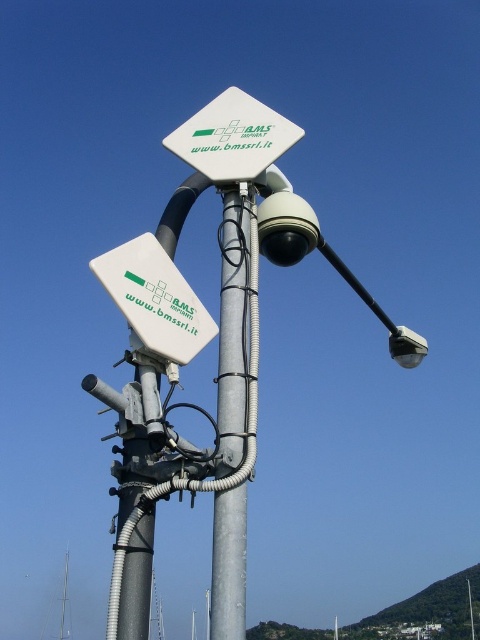
Question: Does white plastic lamp post at upper center appear under white plastic sign at upper center?

Choices:
 (A) yes
 (B) no

Answer: (A)

Question: Estimate the real-world distances between objects in this image. Which object is closer to the galvanized metal pole at center?

Choices:
 (A) white plastic sign at center-left
 (B) white plastic lamp post at upper center
 (C) white plastic sign at upper center

Answer: (B)

Question: Which object appears farthest from the camera in this image?

Choices:
 (A) white plastic sign at upper center
 (B) galvanized metal pole at center
 (C) white plastic sign at center-left
 (D) white plastic lamp post at upper center

Answer: (A)

Question: Is galvanized metal pole at center above white plastic sign at upper center?

Choices:
 (A) no
 (B) yes

Answer: (A)

Question: Which of the following is the farthest from the observer?

Choices:
 (A) (285, 211)
 (B) (232, 157)

Answer: (B)

Question: From the image, what is the correct spatial relationship of galvanized metal pole at center in relation to white plastic sign at center-left?

Choices:
 (A) below
 (B) above

Answer: (B)